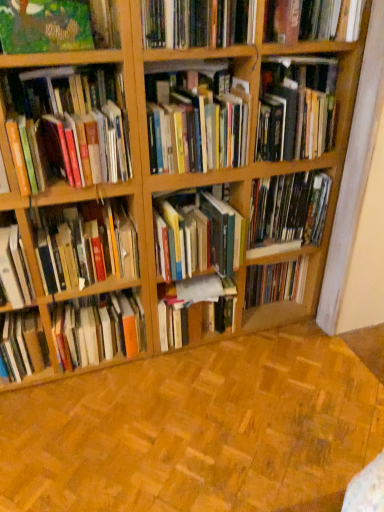
Question: Is hardcover book at upper center, marked as the 2th book in a top-to-bottom arrangement, surrounded by hardcover books at center, placed as the 5th book when sorted from top to bottom?

Choices:
 (A) yes
 (B) no

Answer: (B)

Question: Can you confirm if hardcover books at center, marked as the 9th book in a bottom-to-top arrangement, is taller than hardcover book at upper center, acting as the 12th book starting from the bottom?

Choices:
 (A) yes
 (B) no

Answer: (A)

Question: Considering the relative sizes of hardcover books at center, marked as the 9th book in a bottom-to-top arrangement, and hardcover book at upper center, acting as the 12th book starting from the bottom, in the image provided, is hardcover books at center, marked as the 9th book in a bottom-to-top arrangement, shorter than hardcover book at upper center, acting as the 12th book starting from the bottom,?

Choices:
 (A) no
 (B) yes

Answer: (A)

Question: From a real-world perspective, is hardcover books at center, placed as the 5th book when sorted from top to bottom, beneath hardcover book at upper center, acting as the 12th book starting from the bottom?

Choices:
 (A) yes
 (B) no

Answer: (A)

Question: Does hardcover books at center, marked as the 9th book in a bottom-to-top arrangement, have a larger size compared to hardcover book at upper center, acting as the 12th book starting from the bottom?

Choices:
 (A) yes
 (B) no

Answer: (A)

Question: In terms of height, does hardcover book at lower left, the 4th book positioned from the bottom, look taller or shorter compared to hardcover book at center, placed as the 7th book when sorted from bottom to top?

Choices:
 (A) short
 (B) tall

Answer: (A)

Question: Relative to hardcover book at center, the 7th book viewed from the top, is hardcover book at lower left, the 4th book positioned from the bottom, in front or behind?

Choices:
 (A) front
 (B) behind

Answer: (A)

Question: From the image's perspective, relative to hardcover book at center, placed as the 7th book when sorted from bottom to top, is hardcover book at lower left, placed as the 10th book when sorted from top to bottom, above or below?

Choices:
 (A) above
 (B) below

Answer: (B)

Question: Based on their sizes in the image, would you say hardcover book at lower left, placed as the 10th book when sorted from top to bottom, is bigger or smaller than hardcover book at center, the 7th book viewed from the top?

Choices:
 (A) small
 (B) big

Answer: (A)

Question: From the image's perspective, is hardcover books at center, placed as the 5th book when sorted from top to bottom, positioned above or below hardcover book at lower left, the 4th book positioned from the bottom?

Choices:
 (A) below
 (B) above

Answer: (B)

Question: Considering the positions of hardcover books at center, marked as the 9th book in a bottom-to-top arrangement, and hardcover book at lower left, the 4th book positioned from the bottom, in the image, is hardcover books at center, marked as the 9th book in a bottom-to-top arrangement, wider or thinner than hardcover book at lower left, the 4th book positioned from the bottom,?

Choices:
 (A) thin
 (B) wide

Answer: (A)

Question: Would you say hardcover books at center, placed as the 5th book when sorted from top to bottom, is to the left or to the right of hardcover book at lower left, the 4th book positioned from the bottom, in the picture?

Choices:
 (A) left
 (B) right

Answer: (B)

Question: Considering the positions of hardcover books at center, placed as the 5th book when sorted from top to bottom, and hardcover book at lower left, placed as the 10th book when sorted from top to bottom, in the image, is hardcover books at center, placed as the 5th book when sorted from top to bottom, taller or shorter than hardcover book at lower left, placed as the 10th book when sorted from top to bottom,?

Choices:
 (A) tall
 (B) short

Answer: (B)

Question: Does point (289, 13) appear closer or farther from the camera than point (190, 314)?

Choices:
 (A) closer
 (B) farther

Answer: (A)

Question: Is hardcover book at upper right, which is counted as the 1th book, starting from the top, wider or thinner than hardcover book at center, which is the twelfth book from top to bottom?

Choices:
 (A) thin
 (B) wide

Answer: (B)